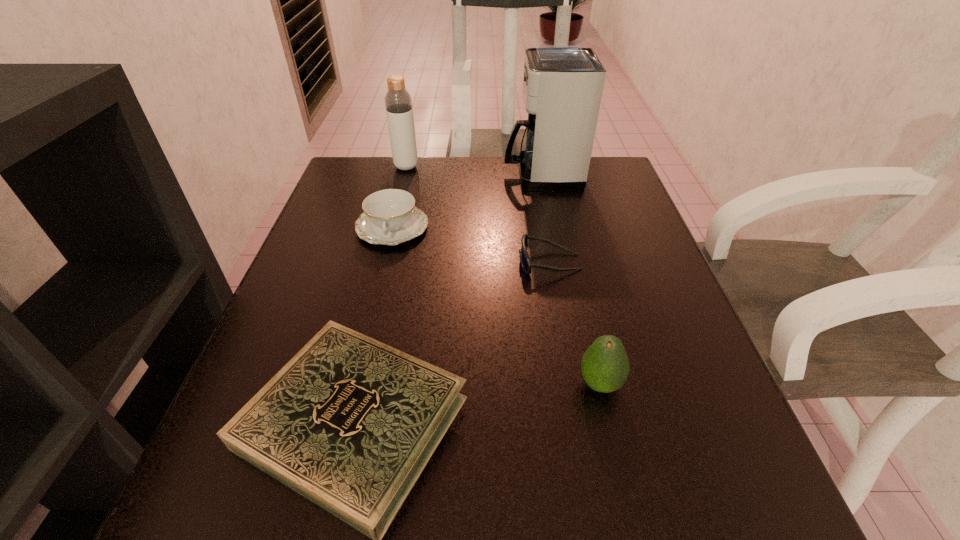
Locate an element on the screen. This screenshot has width=960, height=540. free space located on the handle side of the chinaware is located at coordinates (348, 409).

At what (x,y) coordinates should I click in order to perform the action: click on blank area located 0.110m on the front-facing side of the sunglasses. Please return your answer as a coordinate pair (x, y). Looking at the image, I should click on (466, 262).

Where is `vacant area located on the front-facing side of the sunglasses`? vacant area located on the front-facing side of the sunglasses is located at coordinates (403, 262).

Find the location of a particular element. The width and height of the screenshot is (960, 540). vacant region located 0.270m on the front-facing side of the sunglasses is located at coordinates (388, 262).

At what (x,y) coordinates should I click in order to perform the action: click on coffee maker situated at the far edge. Please return your answer as a coordinate pair (x, y). This screenshot has width=960, height=540. Looking at the image, I should click on (562, 84).

At what (x,y) coordinates should I click in order to perform the action: click on bottle at the far edge. Please return your answer as a coordinate pair (x, y). Looking at the image, I should click on (398, 103).

In order to click on bottle at the left edge in this screenshot , I will do `click(398, 103)`.

Where is `chinaware present at the left edge`? The width and height of the screenshot is (960, 540). chinaware present at the left edge is located at coordinates (390, 217).

Find the location of a particular element. coffee maker situated at the right edge is located at coordinates click(x=562, y=84).

This screenshot has width=960, height=540. Identify the location of avocado that is at the right edge. (605, 367).